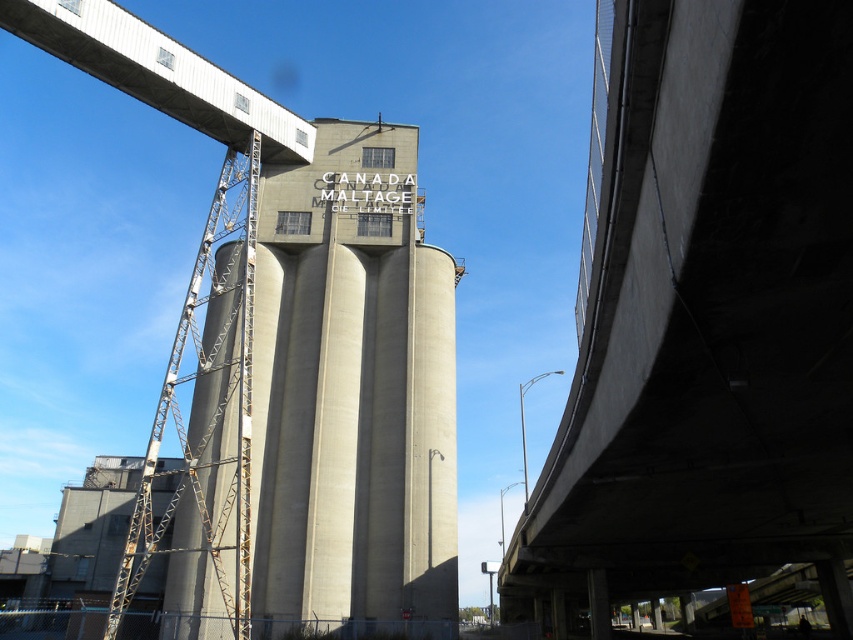
Question: Can you confirm if concrete bridge at upper right is positioned to the right of metallic gray bridge at upper left?

Choices:
 (A) no
 (B) yes

Answer: (B)

Question: Can you confirm if concrete silo at center is positioned to the right of metallic gray bridge at upper left?

Choices:
 (A) yes
 (B) no

Answer: (A)

Question: Estimate the real-world distances between objects in this image. Which object is farther from the concrete silo at center?

Choices:
 (A) concrete bridge at upper right
 (B) metallic gray bridge at upper left

Answer: (A)

Question: Which point is closer to the camera?

Choices:
 (A) concrete silo at center
 (B) concrete bridge at upper right

Answer: (B)

Question: Which object is the closest to the concrete silo at center?

Choices:
 (A) concrete bridge at upper right
 (B) metallic gray bridge at upper left

Answer: (B)

Question: Observing the image, what is the correct spatial positioning of concrete bridge at upper right in reference to metallic gray bridge at upper left?

Choices:
 (A) left
 (B) right

Answer: (B)